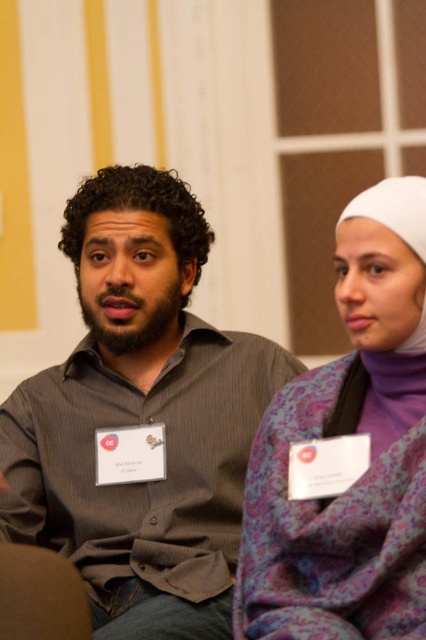
You are at a conference and need to locate the gray shirt at center and the white fabric headscarf at upper right. Which object is positioned higher in the image?

The white fabric headscarf at upper right is positioned higher than the gray shirt at center in the image.

You are organizing a photo shoot and need to ensure that all accessories are visible in the frame. Given the scene described, which accessory has a taller height between the purple paisley scarf at center and the white fabric headscarf at upper right?

The purple paisley scarf at center has a greater height compared to the white fabric headscarf at upper right, so it is taller and more visible in the frame.

You are standing in front of the two people shown in the image. Which of the two points, point (256, 467) or point (425, 182), is closer to you?

Point (256, 467) is closer to you because it is further to the camera than point (425, 182).